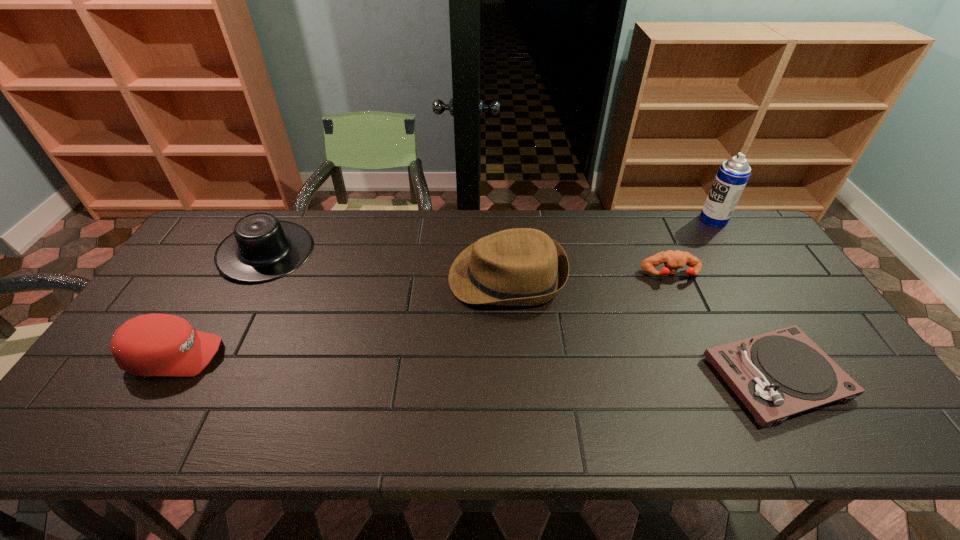
Locate an element on the screen. The height and width of the screenshot is (540, 960). free location at the right edge is located at coordinates (773, 293).

In order to click on vacant space at the far right corner of the desktop in this screenshot , I will do `click(725, 235)`.

Identify the location of free space between the fedora and the cap. This screenshot has height=540, width=960. (341, 316).

You are a GUI agent. You are given a task and a screenshot of the screen. Output one action in this format:
    pyautogui.click(x=<x>, y=<y>)
    Task: Click on the free area in between the tallest object and the puncher
    
    Given the screenshot: What is the action you would take?
    pyautogui.click(x=692, y=247)

Image resolution: width=960 pixels, height=540 pixels. I want to click on free point between the cap and the puncher, so click(x=423, y=315).

Locate an element on the screen. Image resolution: width=960 pixels, height=540 pixels. free point between the puncher and the fourth object from right to left is located at coordinates (588, 275).

Image resolution: width=960 pixels, height=540 pixels. I want to click on free space between the dress hat and the fedora, so click(387, 265).

Image resolution: width=960 pixels, height=540 pixels. I want to click on vacant region between the tallest object and the phonograph_record, so point(745,298).

Find the location of a particular element. unoccupied area between the aerosol can and the cap is located at coordinates (444, 287).

This screenshot has width=960, height=540. Identify the location of empty location between the fourth object from right to left and the puncher. (588, 275).